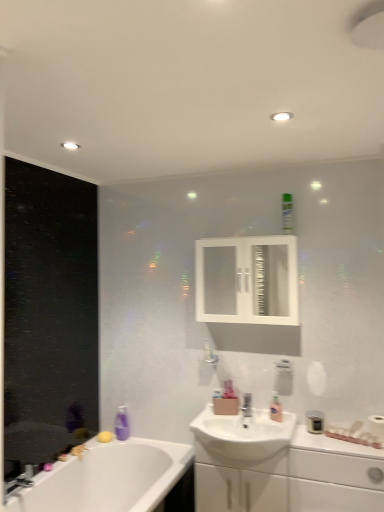
Where is `free point in front of purple plastic soap dispenser at lower left`? free point in front of purple plastic soap dispenser at lower left is located at coordinates (128, 444).